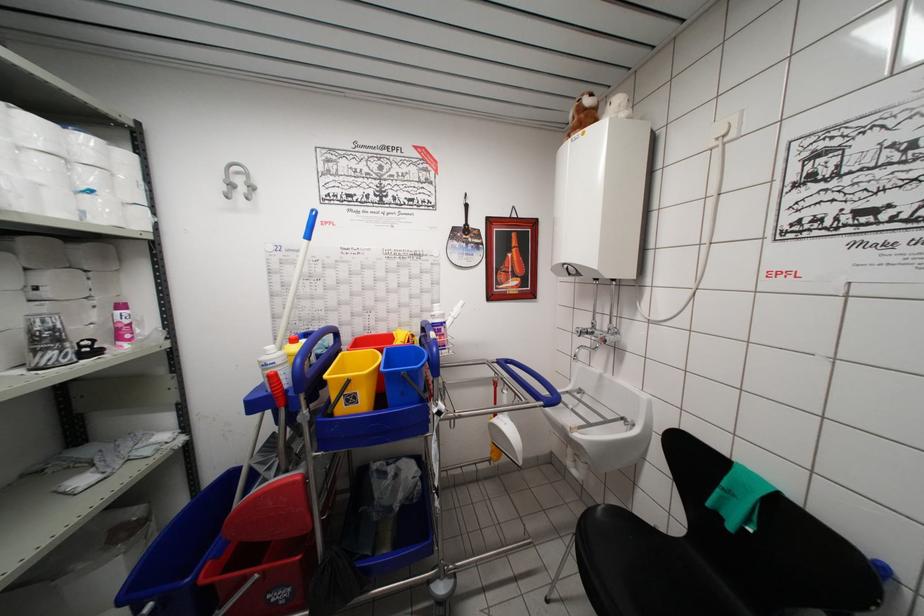
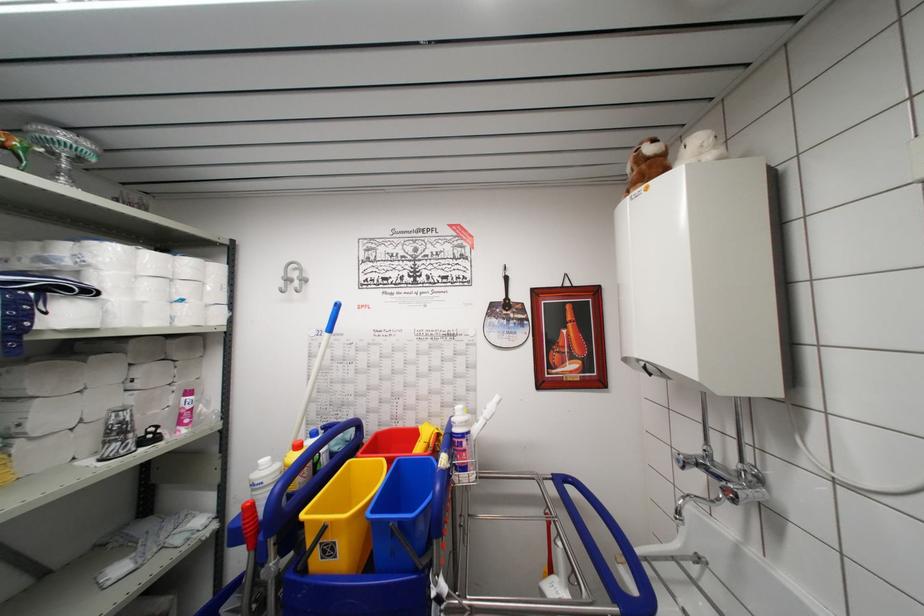
Question: The camera is either moving clockwise (left) or counter-clockwise (right) around the object. The first image is from the beginning of the video and the second image is from the end. Is the camera moving left or right when shooting the video?

Choices:
 (A) Left
 (B) Right

Answer: (B)